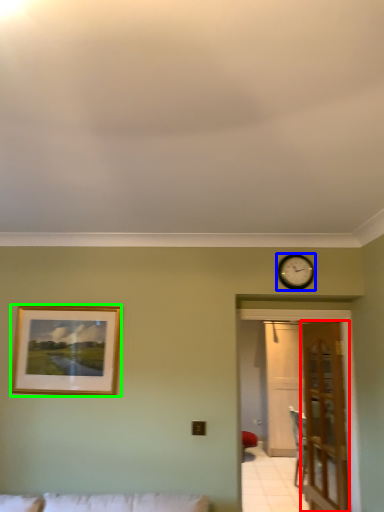
Question: Which is nearer to the door (highlighted by a red box)? wall clock (highlighted by a blue box) or picture frame (highlighted by a green box).

Choices:
 (A) wall clock
 (B) picture frame

Answer: (A)